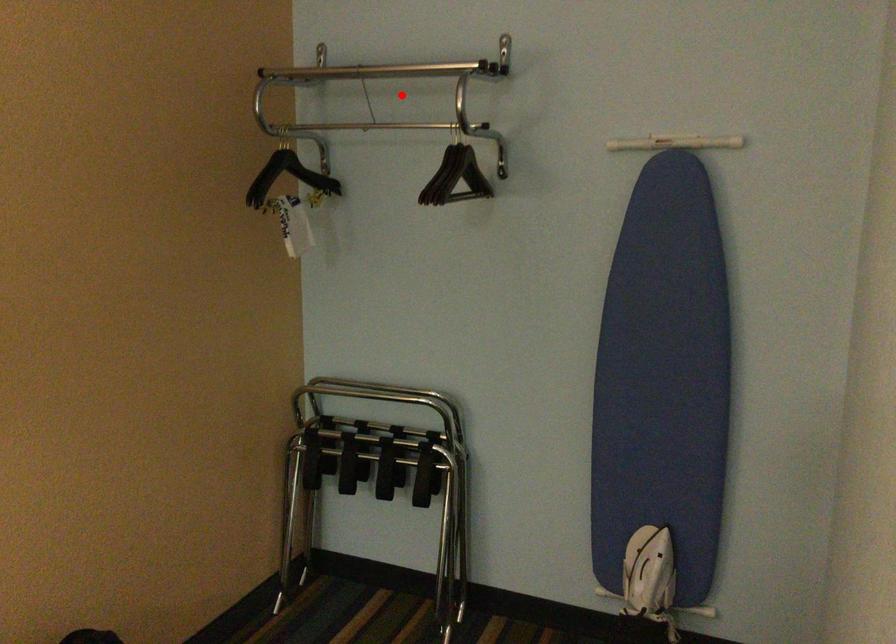
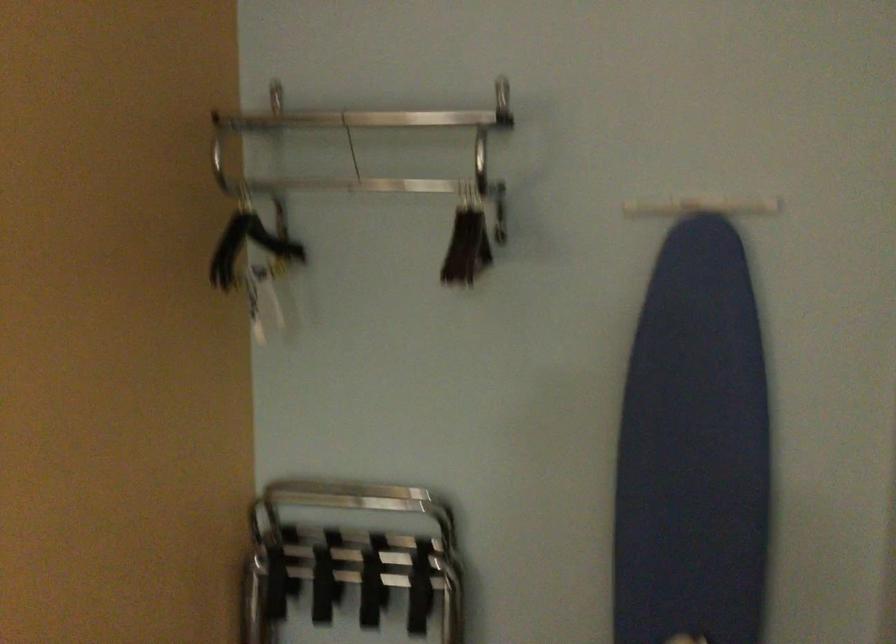
The point at the highlighted location is marked in the first image. Where is the corresponding point in the second image?

(381, 147)